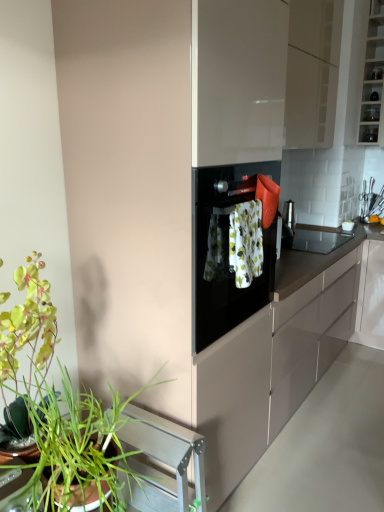
Question: Should I look upward or downward to see floral fabric towel at center?

Choices:
 (A) down
 (B) up

Answer: (B)

Question: From a real-world perspective, is green leafy plant at lower left physically below floral fabric towel at center?

Choices:
 (A) yes
 (B) no

Answer: (A)

Question: Is green leafy plant at lower left thinner than floral fabric towel at center?

Choices:
 (A) yes
 (B) no

Answer: (B)

Question: Does green leafy plant at lower left appear on the right side of floral fabric towel at center?

Choices:
 (A) yes
 (B) no

Answer: (B)

Question: Is floral fabric towel at center at the back of green leafy plant at lower left?

Choices:
 (A) no
 (B) yes

Answer: (A)

Question: Is green leafy plant at lower left positioned behind floral fabric towel at center?

Choices:
 (A) yes
 (B) no

Answer: (B)

Question: Is green leafy plant at lower left bigger than floral fabric towel at center?

Choices:
 (A) yes
 (B) no

Answer: (A)

Question: From a real-world perspective, is black matte countertop at center beneath floral fabric towel at center?

Choices:
 (A) no
 (B) yes

Answer: (B)

Question: Considering the relative sizes of black matte countertop at center and floral fabric towel at center in the image provided, is black matte countertop at center wider than floral fabric towel at center?

Choices:
 (A) no
 (B) yes

Answer: (B)

Question: Does black matte countertop at center lie behind floral fabric towel at center?

Choices:
 (A) no
 (B) yes

Answer: (B)

Question: Is black matte countertop at center turned away from floral fabric towel at center?

Choices:
 (A) yes
 (B) no

Answer: (B)

Question: From the image's perspective, is black matte countertop at center on floral fabric towel at center?

Choices:
 (A) yes
 (B) no

Answer: (B)

Question: From a real-world perspective, is black matte countertop at center on floral fabric towel at center?

Choices:
 (A) no
 (B) yes

Answer: (A)

Question: Is floral fabric towel at center turned away from green leafy plant at lower left?

Choices:
 (A) no
 (B) yes

Answer: (A)